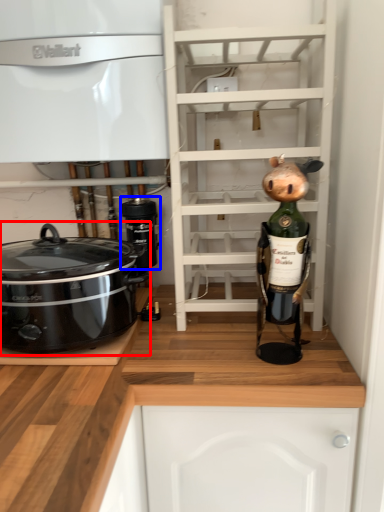
Question: Which object is further to the camera taking this photo, home appliance (highlighted by a red box) or appliance (highlighted by a blue box)?

Choices:
 (A) home appliance
 (B) appliance

Answer: (B)